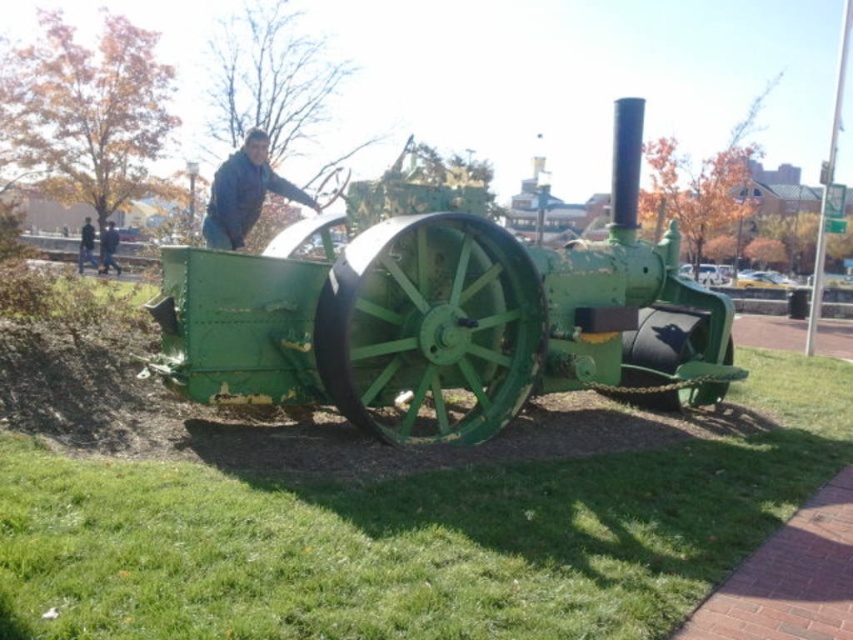
Question: Which of the following is the farthest from the observer?

Choices:
 (A) (114, 262)
 (B) (386, 371)
 (C) (223, 173)

Answer: (A)

Question: Can you confirm if blue denim jacket at upper center is smaller than dark blue jeans at center?

Choices:
 (A) no
 (B) yes

Answer: (A)

Question: Is green grass at lower left wider than dark blue jeans at center?

Choices:
 (A) no
 (B) yes

Answer: (A)

Question: Considering the relative positions of green matte tractor at center and dark blue jacket at upper center in the image provided, where is green matte tractor at center located with respect to dark blue jacket at upper center?

Choices:
 (A) below
 (B) above

Answer: (A)

Question: Which point is farther from the camera taking this photo?

Choices:
 (A) (192, 253)
 (B) (543, 480)
 (C) (221, 202)
 (D) (90, 250)

Answer: (D)

Question: Which object is positioned closest to the dark blue jeans at center?

Choices:
 (A) green grass at lower left
 (B) blue denim jacket at upper center
 (C) dark blue jacket at upper center
 (D) green matte tractor at center

Answer: (B)